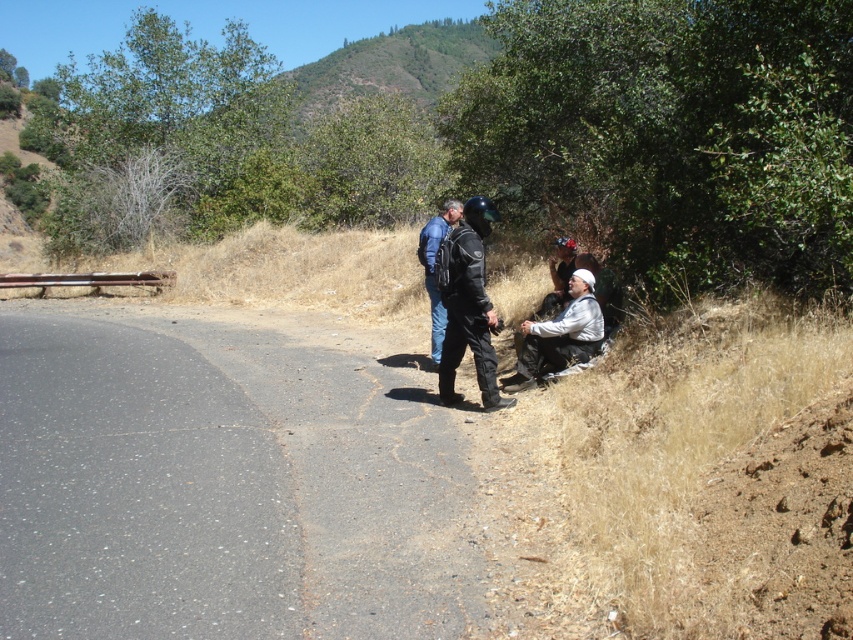
What do you see at coordinates (469, 307) in the screenshot? I see `black leather jacket at center` at bounding box center [469, 307].

Does black leather jacket at center have a greater height compared to white matte jacket at lower right?

Yes.

Between point (461, 339) and point (556, 346), which one is positioned behind?

Point (556, 346)

Image resolution: width=853 pixels, height=640 pixels. What are the coordinates of `black leather jacket at center` in the screenshot? It's located at (469, 307).

Which is below, asphalt road at left or white matte jacket at lower right?

asphalt road at left is below.

Does point (335, 449) come behind point (531, 368)?

That is False.

Where is `asphalt road at left`? Image resolution: width=853 pixels, height=640 pixels. asphalt road at left is located at coordinates (222, 486).

Between black leather jacket at center and matte black jacket at center, which one appears on the left side from the viewer's perspective?

Positioned to the left is matte black jacket at center.

Is black leather jacket at center smaller than matte black jacket at center?

Yes.

Who is more forward, (x=477, y=264) or (x=424, y=234)?

Point (x=477, y=264) is more forward.

Identify the location of black leather jacket at center. (469, 307).